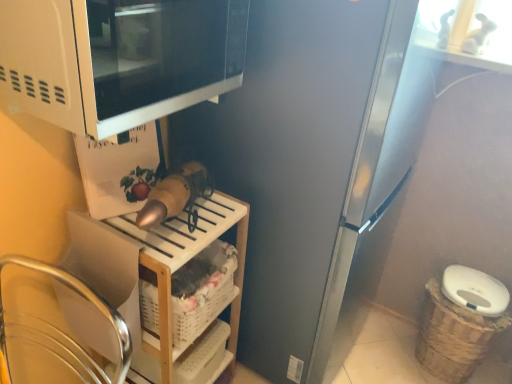
Question: Is satin silver refrigerator at center completely or partially outside of white plastic shelf at lower center?

Choices:
 (A) no
 (B) yes

Answer: (B)

Question: Is white plastic shelf at lower center located within satin silver refrigerator at center?

Choices:
 (A) no
 (B) yes

Answer: (A)

Question: Is satin silver refrigerator at center aimed at white plastic shelf at lower center?

Choices:
 (A) no
 (B) yes

Answer: (A)

Question: From the image's perspective, is satin silver refrigerator at center above white plastic shelf at lower center?

Choices:
 (A) yes
 (B) no

Answer: (A)

Question: From the image's perspective, does satin silver refrigerator at center appear lower than white plastic shelf at lower center?

Choices:
 (A) yes
 (B) no

Answer: (B)

Question: Is satin silver refrigerator at center facing away from white plastic shelf at lower center?

Choices:
 (A) no
 (B) yes

Answer: (A)

Question: Is woven brown basket at lower right, placed as the 1th basket when sorted from right to left, bigger than white matte microwave at upper left?

Choices:
 (A) no
 (B) yes

Answer: (A)

Question: From the image's perspective, does woven brown basket at lower right, which is the second basket from front to back, appear higher than white matte microwave at upper left?

Choices:
 (A) yes
 (B) no

Answer: (B)

Question: Does woven brown basket at lower right, which ranks as the 1th basket in back-to-front order, appear on the left side of white matte microwave at upper left?

Choices:
 (A) yes
 (B) no

Answer: (B)

Question: Considering the relative sizes of woven brown basket at lower right, the second basket from the left, and white matte microwave at upper left in the image provided, is woven brown basket at lower right, the second basket from the left, taller than white matte microwave at upper left?

Choices:
 (A) no
 (B) yes

Answer: (B)

Question: Is woven brown basket at lower right, which ranks as the 1th basket in back-to-front order, oriented towards white matte microwave at upper left?

Choices:
 (A) yes
 (B) no

Answer: (B)

Question: Can we say woven brown basket at lower right, which is the second basket from front to back, lies outside white matte microwave at upper left?

Choices:
 (A) yes
 (B) no

Answer: (A)

Question: From the image's perspective, is satin silver refrigerator at center on top of white matte microwave at upper left?

Choices:
 (A) no
 (B) yes

Answer: (A)